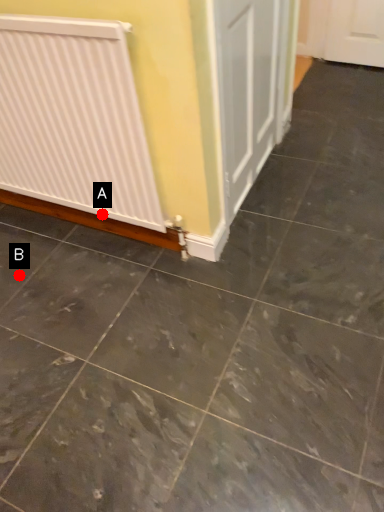
Question: Two points are circled on the image, labeled by A and B beside each circle. Which of the following is the farthest from the observer?

Choices:
 (A) A is further
 (B) B is further

Answer: (A)